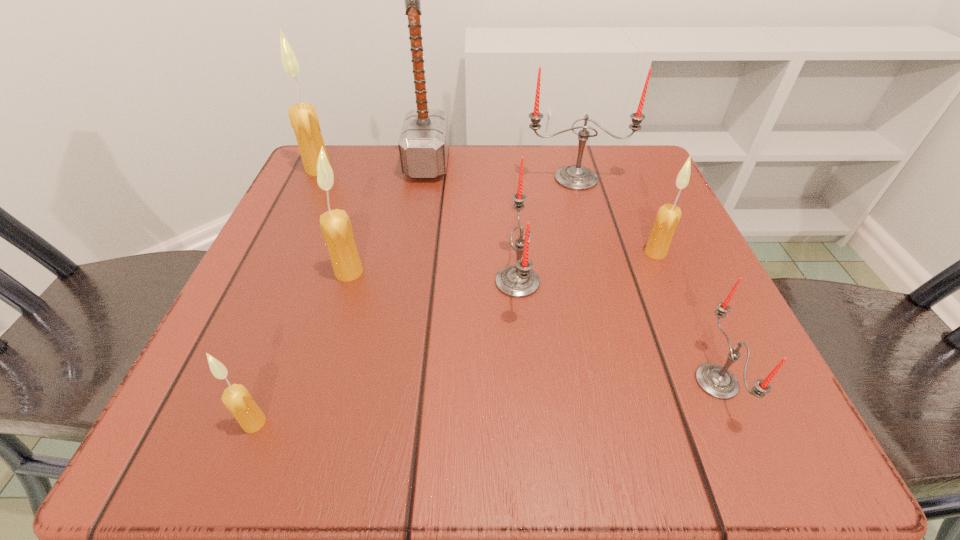
What are the coordinates of `unoccupied position between the hammer and the second biggest red candle` in the screenshot? It's located at (472, 222).

This screenshot has width=960, height=540. Identify the location of unoccupied area between the third biggest cream candle and the third cream candle from left to right. [x=502, y=262].

This screenshot has width=960, height=540. In order to click on free space between the biggest red candle and the smallest cream candle in this screenshot , I will do `click(416, 301)`.

This screenshot has width=960, height=540. What are the coordinates of `unoccupied area between the third cream candle from left to right and the brown hammer` in the screenshot? It's located at (388, 218).

Locate an element on the screen. empty space between the third nearest cream candle and the hammer is located at coordinates (541, 208).

Find the location of a particular element. Image resolution: width=960 pixels, height=540 pixels. vacant space that's between the farthest red candle and the nearest red candle is located at coordinates 646,280.

Find the location of a particular element. This screenshot has height=540, width=960. vacant space that's between the second farthest red candle and the second cream candle from left to right is located at coordinates (386, 352).

Locate an element on the screen. The height and width of the screenshot is (540, 960). object that is the fifth closest to the second smallest red candle is located at coordinates pos(423,144).

I want to click on object that is the fourth closest one to the second smallest red candle, so click(338, 235).

Select which candle appears as the second closest to the brown hammer. Please provide its 2D coordinates. Your answer should be formatted as a tuple, i.e. [(x, y)], where the tuple contains the x and y coordinates of a point satisfying the conditions above.

[(574, 177)]